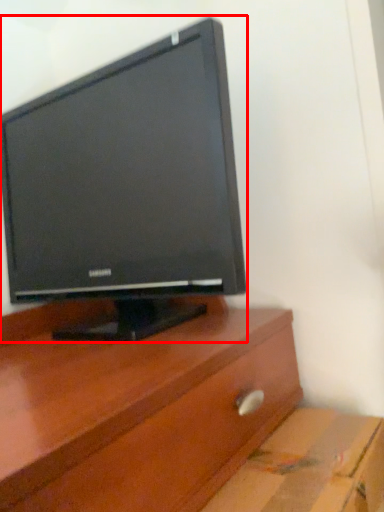
Question: From the image's perspective, where is computer monitor (annotated by the red box) located relative to cardboard box?

Choices:
 (A) below
 (B) above

Answer: (B)